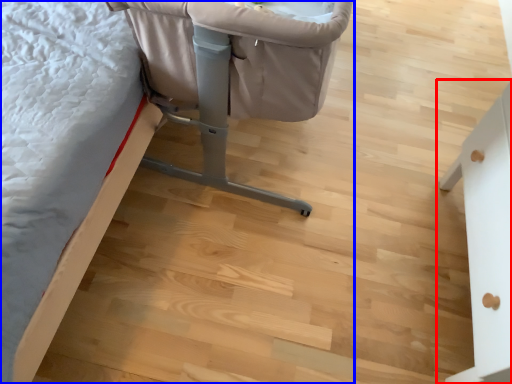
Question: Among these objects, which one is nearest to the camera, furniture (highlighted by a red box) or furniture (highlighted by a blue box)?

Choices:
 (A) furniture
 (B) furniture

Answer: (A)